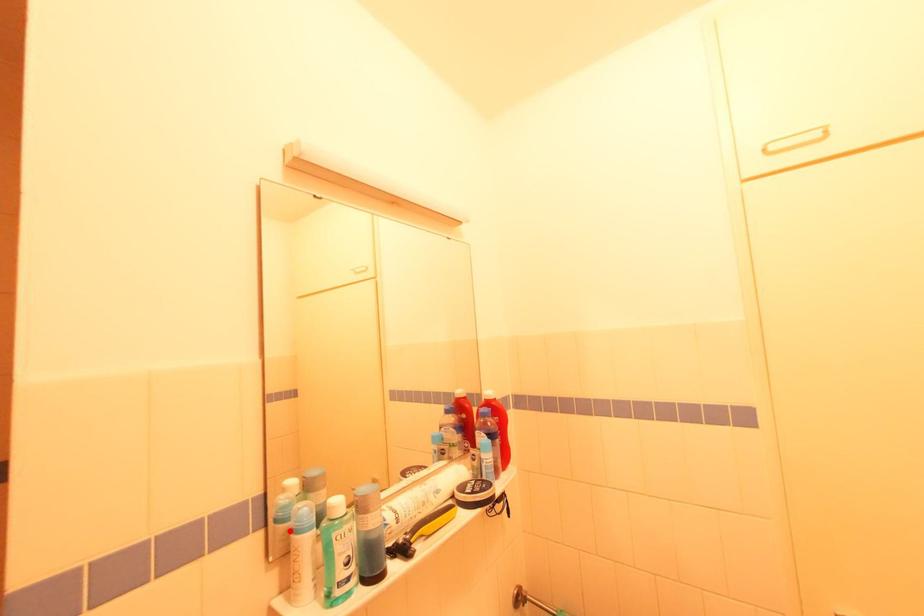
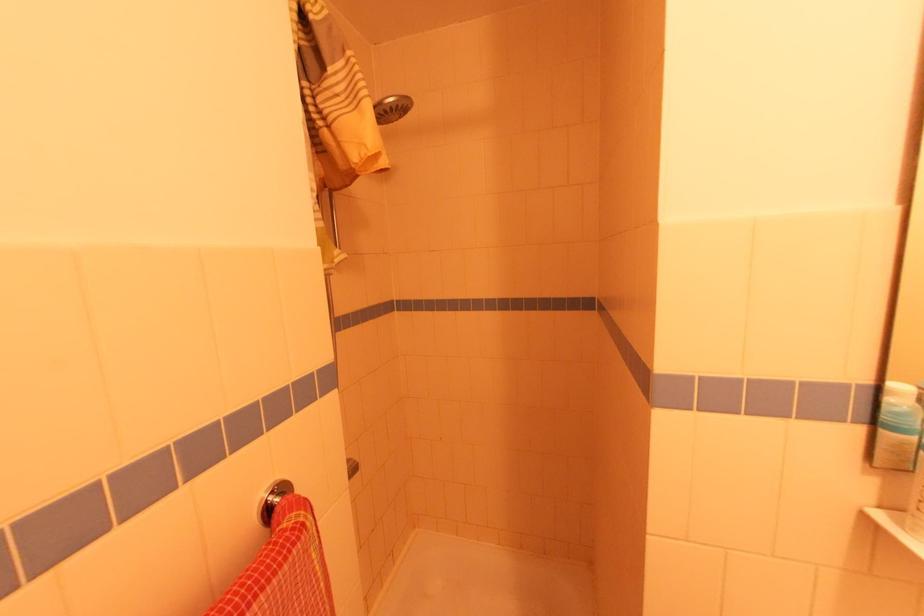
Question: I am providing you with two images of the same scene from different viewpoints. A red point is marked on the first image. At the location where the point appears in image 1, is it still visible in image 2?

Choices:
 (A) Yes
 (B) No

Answer: (A)